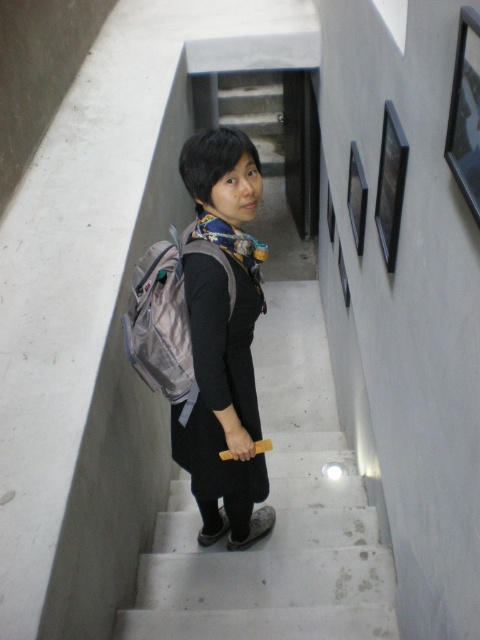
Question: From the image, what is the correct spatial relationship of matte gray stairs at center in relation to matte gray backpack at center?

Choices:
 (A) right
 (B) left

Answer: (A)

Question: Is matte gray backpack at center thinner than silver fabric backpack at center?

Choices:
 (A) no
 (B) yes

Answer: (A)

Question: Based on their relative distances, which object is farther from the matte gray stairs at center?

Choices:
 (A) matte gray backpack at center
 (B) silver fabric backpack at center

Answer: (B)

Question: Considering the relative positions of matte gray stairs at center and silver fabric backpack at center in the image provided, where is matte gray stairs at center located with respect to silver fabric backpack at center?

Choices:
 (A) below
 (B) above

Answer: (A)

Question: Which of the following is the closest to the observer?

Choices:
 (A) (294, 483)
 (B) (252, 141)

Answer: (B)

Question: Which object is the closest to the silver fabric backpack at center?

Choices:
 (A) matte gray stairs at center
 (B) matte gray backpack at center

Answer: (B)